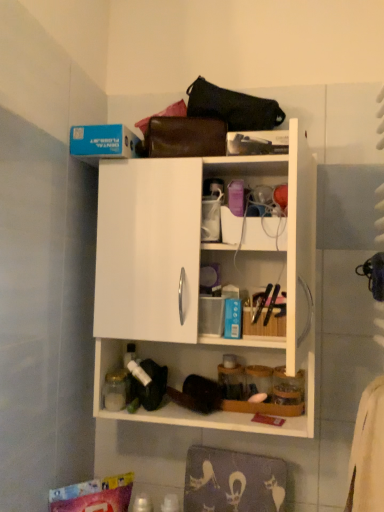
Question: From the image's perspective, would you say black leather handbag at upper center, which is the second handbag in bottom-to-top order, is positioned over white matte cabinet at upper center?

Choices:
 (A) no
 (B) yes

Answer: (B)

Question: Considering the relative sizes of black leather handbag at upper center, the first handbag from the top, and white matte cabinet at upper center in the image provided, is black leather handbag at upper center, the first handbag from the top, wider than white matte cabinet at upper center?

Choices:
 (A) yes
 (B) no

Answer: (B)

Question: Considering the relative sizes of black leather handbag at upper center, the first handbag from the top, and white matte cabinet at upper center in the image provided, is black leather handbag at upper center, the first handbag from the top, smaller than white matte cabinet at upper center?

Choices:
 (A) yes
 (B) no

Answer: (A)

Question: Is the depth of black leather handbag at upper center, which is the second handbag in bottom-to-top order, greater than that of white matte cabinet at upper center?

Choices:
 (A) yes
 (B) no

Answer: (A)

Question: Does black leather handbag at upper center, which is the second handbag in bottom-to-top order, have a lesser height compared to white matte cabinet at upper center?

Choices:
 (A) yes
 (B) no

Answer: (A)

Question: From a real-world perspective, is leather handbag at upper center, acting as the first handbag starting from the bottom, above or below white matte cabinet at upper center?

Choices:
 (A) below
 (B) above

Answer: (B)

Question: Is leather handbag at upper center, acting as the first handbag starting from the bottom, to the left or to the right of white matte cabinet at upper center in the image?

Choices:
 (A) left
 (B) right

Answer: (A)

Question: Is leather handbag at upper center, acting as the second handbag starting from the top, taller or shorter than white matte cabinet at upper center?

Choices:
 (A) short
 (B) tall

Answer: (A)

Question: From the image's perspective, is leather handbag at upper center, acting as the first handbag starting from the bottom, positioned above or below white matte cabinet at upper center?

Choices:
 (A) above
 (B) below

Answer: (A)

Question: Considering the positions of point (188, 108) and point (107, 185), is point (188, 108) closer or farther from the camera than point (107, 185)?

Choices:
 (A) closer
 (B) farther

Answer: (B)

Question: In terms of size, does black leather handbag at upper center, which is the second handbag in bottom-to-top order, appear bigger or smaller than white matte cabinet at upper center?

Choices:
 (A) big
 (B) small

Answer: (B)

Question: Considering the relative positions of black leather handbag at upper center, which is the second handbag in bottom-to-top order, and white matte cabinet at upper center in the image provided, is black leather handbag at upper center, which is the second handbag in bottom-to-top order, to the left or to the right of white matte cabinet at upper center?

Choices:
 (A) left
 (B) right

Answer: (B)

Question: Is black leather handbag at upper center, the first handbag from the top, in front of or behind white matte cabinet at upper center in the image?

Choices:
 (A) behind
 (B) front

Answer: (A)

Question: Considering the positions of white matte cabinet at upper center and leather handbag at upper center, acting as the first handbag starting from the bottom, in the image, is white matte cabinet at upper center bigger or smaller than leather handbag at upper center, acting as the first handbag starting from the bottom,?

Choices:
 (A) big
 (B) small

Answer: (A)

Question: Is white matte cabinet at upper center wider or thinner than leather handbag at upper center, acting as the second handbag starting from the top?

Choices:
 (A) wide
 (B) thin

Answer: (A)